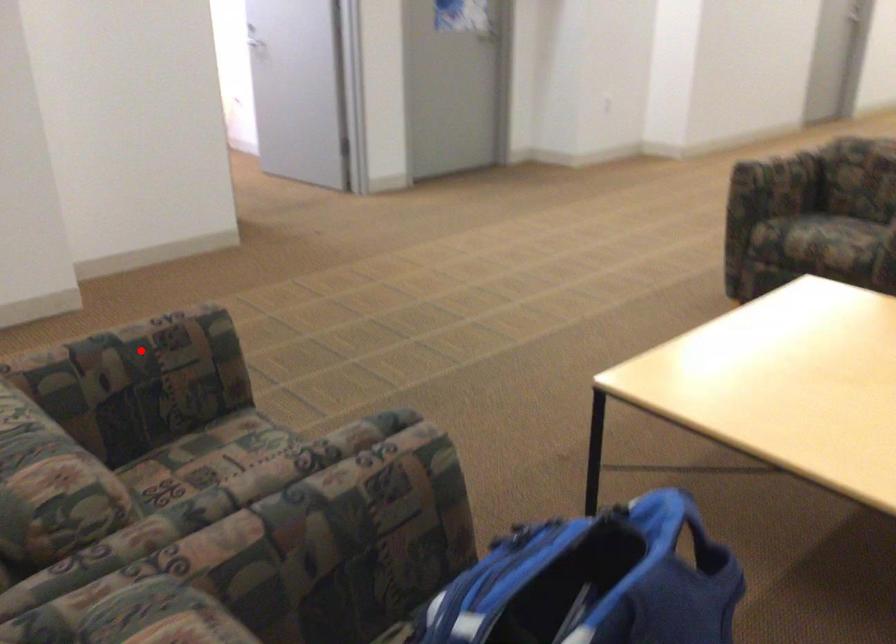
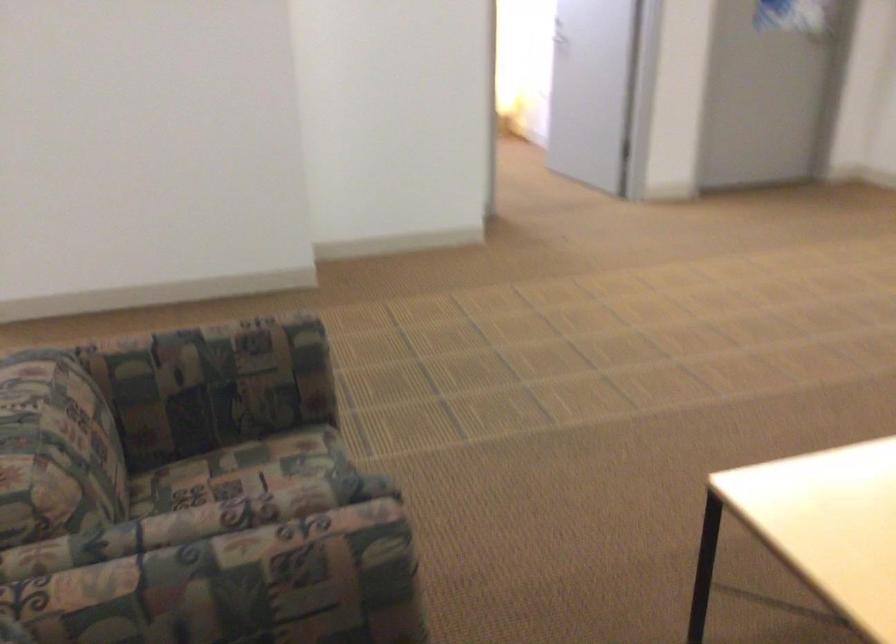
Question: I am providing you with two images of the same scene from different viewpoints. A red point is marked on the first image. Is the red point's position out of view in image 2?

Choices:
 (A) Yes
 (B) No

Answer: (B)